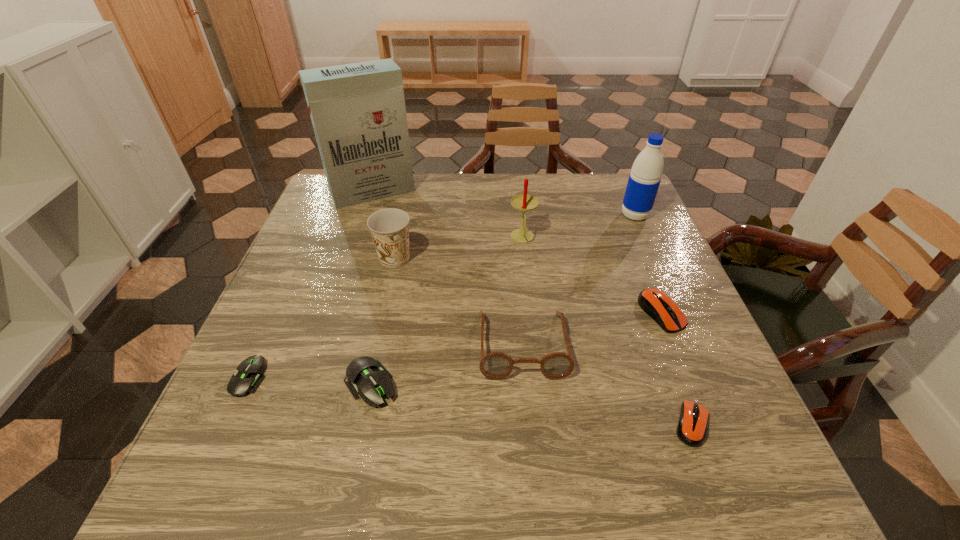
Locate an element on the screen. Image resolution: width=960 pixels, height=540 pixels. free space located on the left of the bigger gray computer mouse is located at coordinates (290, 384).

You are a GUI agent. You are given a task and a screenshot of the screen. Output one action in this format:
    pyautogui.click(x=<x>, y=<y>)
    Task: Click on the free space located on the back of the nearer orange computer mouse
    
    Given the screenshot: What is the action you would take?
    pyautogui.click(x=664, y=350)

Image resolution: width=960 pixels, height=540 pixels. I want to click on free space located 0.370m on the right of the leftmost computer mouse, so click(458, 378).

At what (x,y) coordinates should I click in order to perform the action: click on cigarette case present at the far edge. Please return your answer as a coordinate pair (x, y). This screenshot has height=540, width=960. Looking at the image, I should click on (358, 113).

This screenshot has width=960, height=540. I want to click on water bottle that is at the far edge, so click(645, 177).

At what (x,y) coordinates should I click in order to perform the action: click on object that is at the near edge. Please return your answer as a coordinate pair (x, y). The height and width of the screenshot is (540, 960). Looking at the image, I should click on (692, 426).

Identify the location of cigarette case positioned at the left edge. The image size is (960, 540). (358, 113).

Where is `computer mouse that is at the left edge`? This screenshot has height=540, width=960. computer mouse that is at the left edge is located at coordinates (248, 378).

Where is `water bottle located at the right edge`? water bottle located at the right edge is located at coordinates (645, 177).

Find the location of a particular element. This screenshot has width=960, height=540. object at the far left corner is located at coordinates (358, 113).